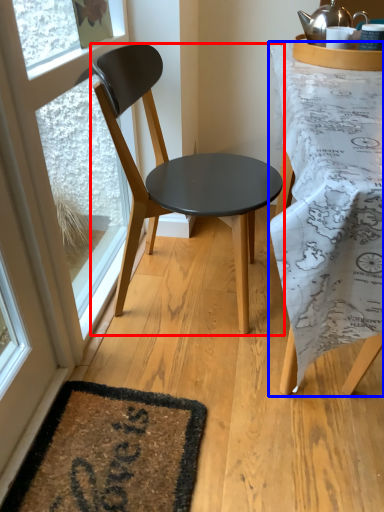
Question: Which object is further to the camera taking this photo, chair (highlighted by a red box) or desk (highlighted by a blue box)?

Choices:
 (A) chair
 (B) desk

Answer: (A)